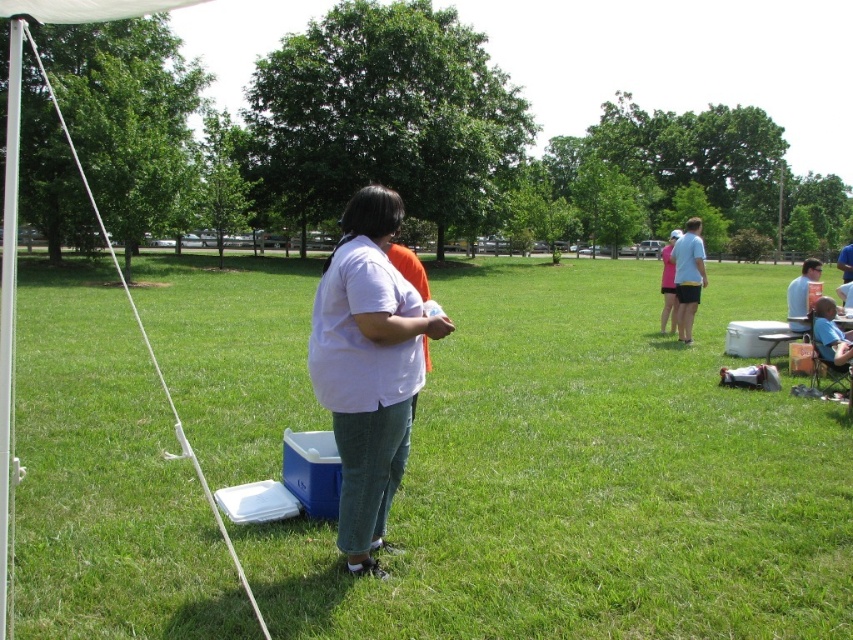
Between light blue shirt at center and blue fabric chair at lower right, which one appears on the right side from the viewer's perspective?

light blue shirt at center is more to the right.

Is point (675, 259) closer to viewer compared to point (813, 342)?

No, (675, 259) is further to viewer.

Where is `light blue shirt at center`? light blue shirt at center is located at coordinates (688, 276).

Is the position of white matte shirt at center less distant than that of blue denim shorts at right?

Yes.

Is point (369, 449) positioned behind point (801, 321)?

That is False.

Between point (399, 403) and point (820, 266), which one is positioned behind?

The point (820, 266) is more distant.

Where is `white matte shirt at center`? The width and height of the screenshot is (853, 640). white matte shirt at center is located at coordinates (368, 368).

Can you confirm if green grass at center is positioned to the right of white matte shirt at center?

Yes, green grass at center is to the right of white matte shirt at center.

Does green grass at center have a larger size compared to white matte shirt at center?

Yes.

This screenshot has height=640, width=853. What do you see at coordinates (589, 477) in the screenshot? I see `green grass at center` at bounding box center [589, 477].

Identify the location of green grass at center. The height and width of the screenshot is (640, 853). (589, 477).